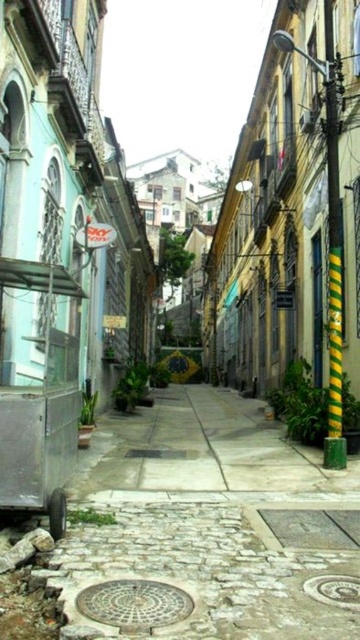
Question: Where is yellow-green striped pole at right located in relation to metallic circular manhole cover at lower center in the image?

Choices:
 (A) right
 (B) left

Answer: (A)

Question: Does metallic textured manhole cover at center have a smaller size compared to metallic circular manhole cover at lower center?

Choices:
 (A) no
 (B) yes

Answer: (A)

Question: Considering the real-world distances, which object is closest to the metallic circular manhole cover at lower center?

Choices:
 (A) metallic textured manhole cover at center
 (B) yellow-green striped pole at right

Answer: (A)

Question: Which object is the farthest from the metallic circular manhole cover at lower center?

Choices:
 (A) metallic textured manhole cover at center
 (B) yellow-green striped pole at right

Answer: (B)

Question: Observing the image, what is the correct spatial positioning of metallic textured manhole cover at center in reference to metallic circular manhole cover at lower center?

Choices:
 (A) right
 (B) left

Answer: (B)

Question: Among these points, which one is farthest from the camera?

Choices:
 (A) (329, 577)
 (B) (339, 236)
 (C) (100, 621)

Answer: (B)